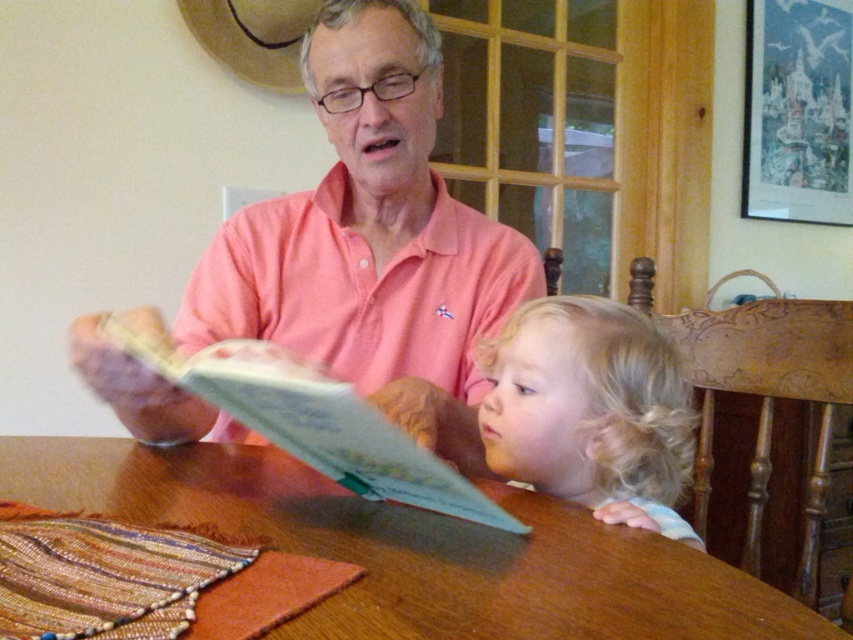
You are an interior designer analyzing the placement of objects in this room. The blonde hair at center is located at coordinates point 0.642, 0.693. Can you determine if this position is closer to the top or bottom of the image?

The position of blonde hair at center is at point 0.693 on the vertical axis. Since 0.693 is closer to 1.0 than to 0.0, it is closer to the bottom of the image.

You are trying to determine if the wooden table at center can fit a small plate that is the same size as the blonde hair at center. Based on the scene description, will it fit?

The wooden table at center occupies less space than blonde hair at center, so the table is smaller than the hair. Therefore, the small plate would not fit on the wooden table at center.